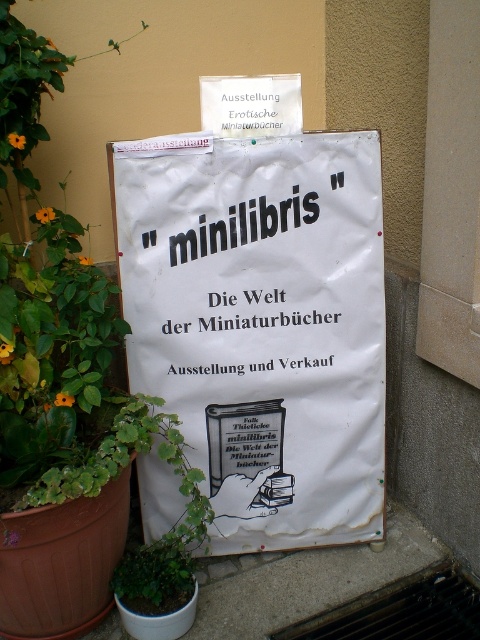
Question: Can you confirm if white paper sign at center is positioned above green leafy plant at lower left?

Choices:
 (A) yes
 (B) no

Answer: (A)

Question: Can you confirm if white paper sign at center is wider than green leafy plant at lower left?

Choices:
 (A) no
 (B) yes

Answer: (B)

Question: Which point appears farthest from the camera in this image?

Choices:
 (A) (188, 573)
 (B) (217, 401)

Answer: (B)

Question: Which point is farther to the camera?

Choices:
 (A) green leafy plant at lower left
 (B) white paper sign at center

Answer: (B)

Question: In this image, where is white paper sign at center located relative to green leafy plant at lower left?

Choices:
 (A) left
 (B) right

Answer: (B)